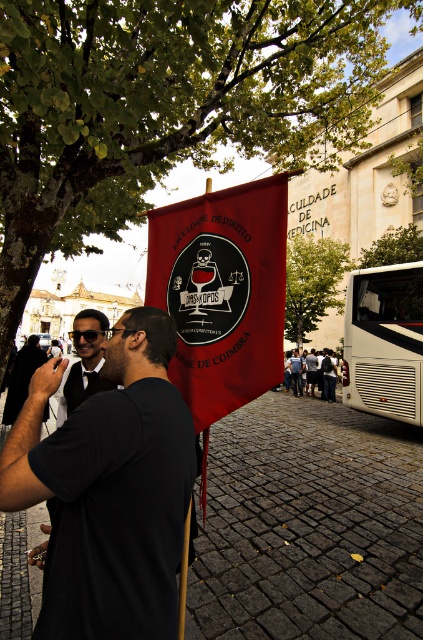
Question: Considering the real-world distances, which object is farthest from the matte black sunglasses at center?

Choices:
 (A) black matte t-shirt at center
 (B) red matte flag at center
 (C) white metallic bus at right

Answer: (C)

Question: Observing the image, what is the correct spatial positioning of black matte t-shirt at center in reference to white metallic bus at right?

Choices:
 (A) left
 (B) right

Answer: (A)

Question: Which object is positioned closest to the black matte t-shirt at center?

Choices:
 (A) white metallic bus at right
 (B) matte black sunglasses at center

Answer: (B)

Question: Which object appears farthest from the camera in this image?

Choices:
 (A) black matte t-shirt at center
 (B) red matte flag at center
 (C) matte black sunglasses at center
 (D) white metallic bus at right

Answer: (D)

Question: From the image, what is the correct spatial relationship of black matte t-shirt at center in relation to white metallic bus at right?

Choices:
 (A) left
 (B) right

Answer: (A)

Question: Is black matte t-shirt at center thinner than matte black sunglasses at center?

Choices:
 (A) no
 (B) yes

Answer: (B)